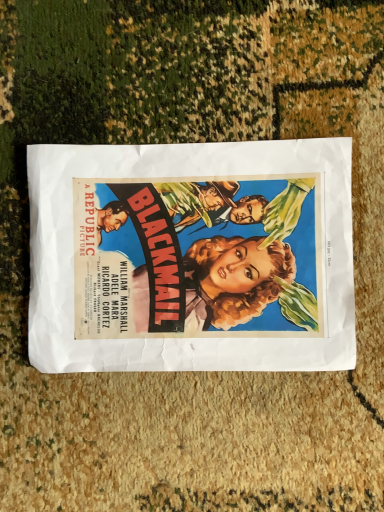
Find the location of a particular element. The image size is (384, 512). blank space situated above matte paper poster at center (from a real-world perspective) is located at coordinates (196, 258).